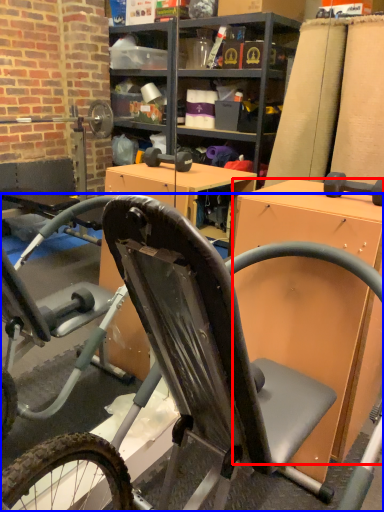
Question: Which point is closer to the camera, desk (highlighted by a red box) or bicycle (highlighted by a blue box)?

Choices:
 (A) desk
 (B) bicycle

Answer: (B)